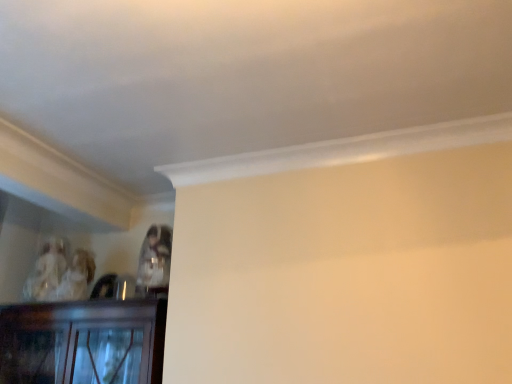
You are a GUI agent. You are given a task and a screenshot of the screen. Output one action in this format:
    pyautogui.click(x=<x>, y=<y>)
    Task: Click on the matte white porcelain figurine at upper left, the 1th person when ordered from back to front
    The image size is (512, 384).
    Given the screenshot: What is the action you would take?
    pyautogui.click(x=46, y=270)

Describe the element at coordinates (46, 270) in the screenshot. Image resolution: width=512 pixels, height=384 pixels. I see `matte white porcelain figurine at upper left, which is the 2th person in right-to-left order` at that location.

The width and height of the screenshot is (512, 384). I want to click on matte plastic cup at upper center, which is the 1th person from right to left, so 155,259.

Describe the element at coordinates (155, 259) in the screenshot. The image size is (512, 384). I see `matte plastic cup at upper center, the second person viewed from the back` at that location.

The height and width of the screenshot is (384, 512). Identify the location of matte white porcelain figurine at upper left, arranged as the 1th person when viewed from the left. (46, 270).

Considering the positions of objects matte white porcelain figurine at upper left, which is the 2th person in right-to-left order, and matte plastic cup at upper center, which is the 1th person from right to left, in the image provided, who is more to the right, matte white porcelain figurine at upper left, which is the 2th person in right-to-left order, or matte plastic cup at upper center, which is the 1th person from right to left,?

matte plastic cup at upper center, which is the 1th person from right to left.

Is matte white porcelain figurine at upper left, arranged as the 1th person when viewed from the left, closer to the viewer compared to matte plastic cup at upper center, the second person in the left-to-right sequence?

That is False.

Is point (25, 296) behind point (152, 264)?

Yes, point (25, 296) is farther from viewer.

From the image's perspective, is matte white porcelain figurine at upper left, which is the 2th person in right-to-left order, positioned above or below matte plastic cup at upper center, the second person in the left-to-right sequence?

Clearly, from the image's perspective, matte white porcelain figurine at upper left, which is the 2th person in right-to-left order, is below matte plastic cup at upper center, the second person in the left-to-right sequence.

From a real-world perspective, is matte white porcelain figurine at upper left, the 1th person when ordered from back to front, physically above matte plastic cup at upper center, the second person in the left-to-right sequence?

Yes, from a real-world perspective, matte white porcelain figurine at upper left, the 1th person when ordered from back to front, is over matte plastic cup at upper center, the second person in the left-to-right sequence

Does matte white porcelain figurine at upper left, which is the 2th person in right-to-left order, have a lesser width compared to matte plastic cup at upper center, acting as the 1th person starting from the front?

No, matte white porcelain figurine at upper left, which is the 2th person in right-to-left order, is not thinner than matte plastic cup at upper center, acting as the 1th person starting from the front.

Which of these two, matte white porcelain figurine at upper left, positioned as the 2th person in front-to-back order, or matte plastic cup at upper center, the second person viewed from the back, stands taller?

With more height is matte white porcelain figurine at upper left, positioned as the 2th person in front-to-back order.

Can you confirm if matte white porcelain figurine at upper left, arranged as the 1th person when viewed from the left, is bigger than matte plastic cup at upper center, which is the 1th person from right to left?

Yes.

Is matte plastic cup at upper center, which is the 1th person from right to left, located within matte white porcelain figurine at upper left, which is the 2th person in right-to-left order?

Definitely not — matte plastic cup at upper center, which is the 1th person from right to left, is not inside matte white porcelain figurine at upper left, which is the 2th person in right-to-left order.

Is matte white porcelain figurine at upper left, which is the 2th person in right-to-left order, directly adjacent to matte plastic cup at upper center, acting as the 1th person starting from the front?

matte white porcelain figurine at upper left, which is the 2th person in right-to-left order, is not next to matte plastic cup at upper center, acting as the 1th person starting from the front, and they're not touching.

Could you tell me if matte white porcelain figurine at upper left, positioned as the 2th person in front-to-back order, is facing matte plastic cup at upper center, the second person viewed from the back?

No, matte white porcelain figurine at upper left, positioned as the 2th person in front-to-back order, is not aimed at matte plastic cup at upper center, the second person viewed from the back.

How many degrees apart are the facing directions of matte white porcelain figurine at upper left, which is the 2th person in right-to-left order, and matte plastic cup at upper center, the second person viewed from the back?

The angular difference between matte white porcelain figurine at upper left, which is the 2th person in right-to-left order, and matte plastic cup at upper center, the second person viewed from the back, is 0.000306 degrees.

Could you measure the distance between matte white porcelain figurine at upper left, positioned as the 2th person in front-to-back order, and matte plastic cup at upper center, acting as the 1th person starting from the front?

22.52 inches.

The width and height of the screenshot is (512, 384). I want to click on person in front of the matte white porcelain figurine at upper left, the 1th person when ordered from back to front, so click(x=155, y=259).

Can you confirm if matte plastic cup at upper center, which is the 1th person from right to left, is positioned to the right of matte white porcelain figurine at upper left, arranged as the 1th person when viewed from the left?

Correct, you'll find matte plastic cup at upper center, which is the 1th person from right to left, to the right of matte white porcelain figurine at upper left, arranged as the 1th person when viewed from the left.

Between matte plastic cup at upper center, which is the 1th person from right to left, and matte white porcelain figurine at upper left, arranged as the 1th person when viewed from the left, which one is positioned behind?

matte white porcelain figurine at upper left, arranged as the 1th person when viewed from the left, is further away from the camera.

Does point (143, 267) come farther from viewer compared to point (46, 291)?

Yes, it is.

From the image's perspective, relative to matte white porcelain figurine at upper left, the 1th person when ordered from back to front, is matte plastic cup at upper center, which is the 1th person from right to left, above or below?

Based on their image positions, matte plastic cup at upper center, which is the 1th person from right to left, is located above matte white porcelain figurine at upper left, the 1th person when ordered from back to front.

From the picture: From a real-world perspective, between matte plastic cup at upper center, the second person in the left-to-right sequence, and matte white porcelain figurine at upper left, positioned as the 2th person in front-to-back order, who is vertically higher?

matte white porcelain figurine at upper left, positioned as the 2th person in front-to-back order, from a real-world perspective.

Is matte plastic cup at upper center, the second person viewed from the back, wider or thinner than matte white porcelain figurine at upper left, arranged as the 1th person when viewed from the left?

Considering their sizes, matte plastic cup at upper center, the second person viewed from the back, looks slimmer than matte white porcelain figurine at upper left, arranged as the 1th person when viewed from the left.

In terms of height, does matte plastic cup at upper center, the second person in the left-to-right sequence, look taller or shorter compared to matte white porcelain figurine at upper left, which is the 2th person in right-to-left order?

matte plastic cup at upper center, the second person in the left-to-right sequence, is shorter than matte white porcelain figurine at upper left, which is the 2th person in right-to-left order.

Considering the sizes of matte plastic cup at upper center, which is the 1th person from right to left, and matte white porcelain figurine at upper left, positioned as the 2th person in front-to-back order, in the image, is matte plastic cup at upper center, which is the 1th person from right to left, bigger or smaller than matte white porcelain figurine at upper left, positioned as the 2th person in front-to-back order,?

In the image, matte plastic cup at upper center, which is the 1th person from right to left, appears to be smaller than matte white porcelain figurine at upper left, positioned as the 2th person in front-to-back order.

Is matte plastic cup at upper center, which is the 1th person from right to left, not within matte white porcelain figurine at upper left, arranged as the 1th person when viewed from the left?

Yes, matte plastic cup at upper center, which is the 1th person from right to left, is not within matte white porcelain figurine at upper left, arranged as the 1th person when viewed from the left.

Is matte plastic cup at upper center, acting as the 1th person starting from the front, positioned far away from matte white porcelain figurine at upper left, the 1th person when ordered from back to front?

matte plastic cup at upper center, acting as the 1th person starting from the front, is actually quite close to matte white porcelain figurine at upper left, the 1th person when ordered from back to front.

Is matte plastic cup at upper center, the second person viewed from the back, oriented away from matte white porcelain figurine at upper left, which is the 2th person in right-to-left order?

matte plastic cup at upper center, the second person viewed from the back, is not turned away from matte white porcelain figurine at upper left, which is the 2th person in right-to-left order.

How many degrees apart are the facing directions of matte plastic cup at upper center, which is the 1th person from right to left, and matte white porcelain figurine at upper left, arranged as the 1th person when viewed from the left?

0.000306 degrees.

Image resolution: width=512 pixels, height=384 pixels. Find the location of `person located above the matte plastic cup at upper center, the second person in the left-to-right sequence (from a real-world perspective)`. person located above the matte plastic cup at upper center, the second person in the left-to-right sequence (from a real-world perspective) is located at coordinates (46, 270).

Identify the location of person to the right of matte white porcelain figurine at upper left, positioned as the 2th person in front-to-back order. (155, 259).

Identify the location of person located below the matte plastic cup at upper center, the second person viewed from the back (from the image's perspective). The image size is (512, 384). (46, 270).